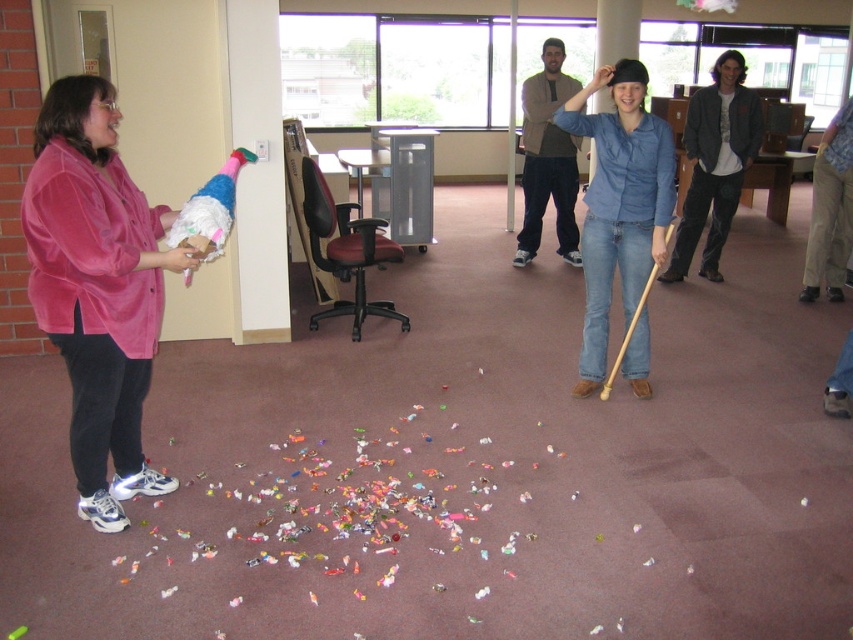
From the picture: You are at a party and want to hand out a gift to the shortest person between the velvet pink jacket at left and the denim shirt at center. Which one should you approach?

The velvet pink jacket at left is not as tall as the denim shirt at center, so you should approach the velvet pink jacket at left.

You are organizing a party and need to arrange the velvet pink jacket at left and the denim shirt at center for a photo shoot. According to the scene, which item should be placed on the left side of the photo to match the original arrangement?

The velvet pink jacket at left should be placed on the left side of the photo because it was originally positioned to the left of the denim shirt at center in the scene.

Looking at this image, you are a photographer standing near the camera. You want to hand the velvet pink jacket at left to someone across the room without moving. Can you throw it? Explain why or why not based on the distance.

The velvet pink jacket at left and camera are 2.39 meters apart. Since the distance is about 2.4 meters, it might be challenging to throw the jacket accurately that far, especially without moving. The photographer should consider moving closer or asking someone else to deliver it.